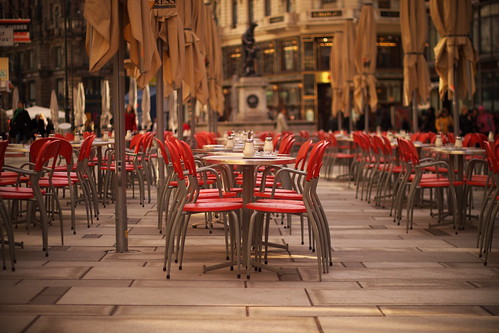
This screenshot has height=333, width=499. In order to click on silver tables in this screenshot , I will do `click(233, 163)`, `click(237, 152)`, `click(13, 155)`, `click(104, 141)`, `click(461, 152)`, `click(427, 148)`, `click(419, 142)`, `click(217, 147)`, `click(259, 141)`, `click(219, 138)`.